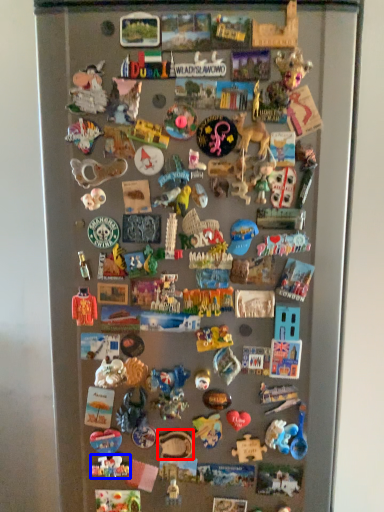
Question: Among these objects, which one is farthest to the camera, toy (highlighted by a red box) or toy (highlighted by a blue box)?

Choices:
 (A) toy
 (B) toy

Answer: (B)